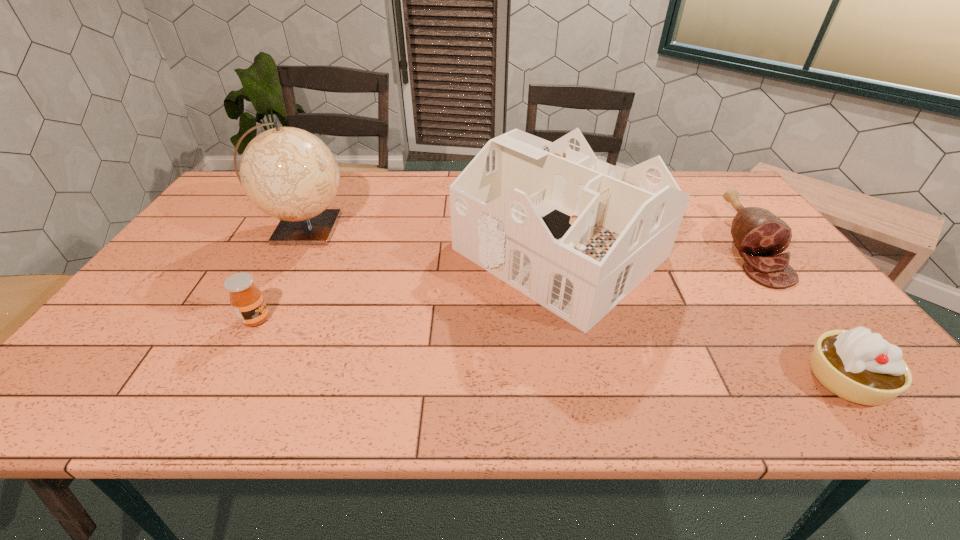
This screenshot has width=960, height=540. In the image, there is a desktop. Identify the location of vacant region at the far right corner. (680, 177).

Locate an element on the screen. The height and width of the screenshot is (540, 960). vacant space that's between the honey and the whipped cream is located at coordinates (551, 349).

This screenshot has width=960, height=540. In order to click on vacant space that's between the ham and the honey in this screenshot , I will do `click(502, 283)`.

Locate an element on the screen. The width and height of the screenshot is (960, 540). vacant space in between the globe and the honey is located at coordinates (280, 274).

In order to click on free space between the honey and the whipped cream in this screenshot , I will do `click(551, 349)`.

Find the location of a particular element. Image resolution: width=960 pixels, height=540 pixels. free area in between the honey and the fourth shortest object is located at coordinates 408,286.

Identify the location of free space between the honey and the ham. (502, 283).

Locate an element on the screen. empty location between the ham and the whipped cream is located at coordinates (797, 313).

Locate an element on the screen. object that ranks as the second closest to the ham is located at coordinates (858, 366).

Locate which object ranks fourth in proximity to the third object from right to left. Please provide its 2D coordinates. Your answer should be formatted as a tuple, i.e. [(x, y)], where the tuple contains the x and y coordinates of a point satisfying the conditions above.

[(246, 299)]